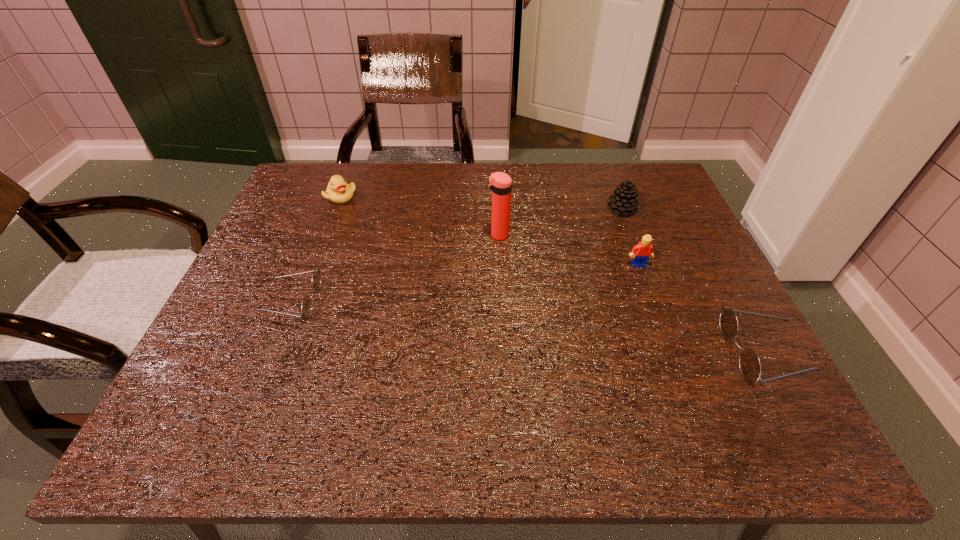
Where is `spot to insert another spectacles for uniform distribution`? This screenshot has height=540, width=960. spot to insert another spectacles for uniform distribution is located at coordinates (516, 327).